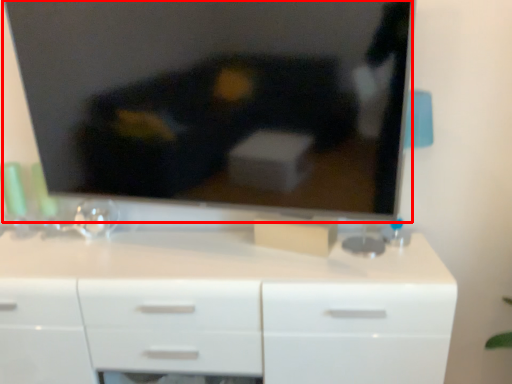
Question: From the image, what is the correct spatial relationship of television (annotated by the red box) in relation to chest of drawers?

Choices:
 (A) right
 (B) left

Answer: (A)